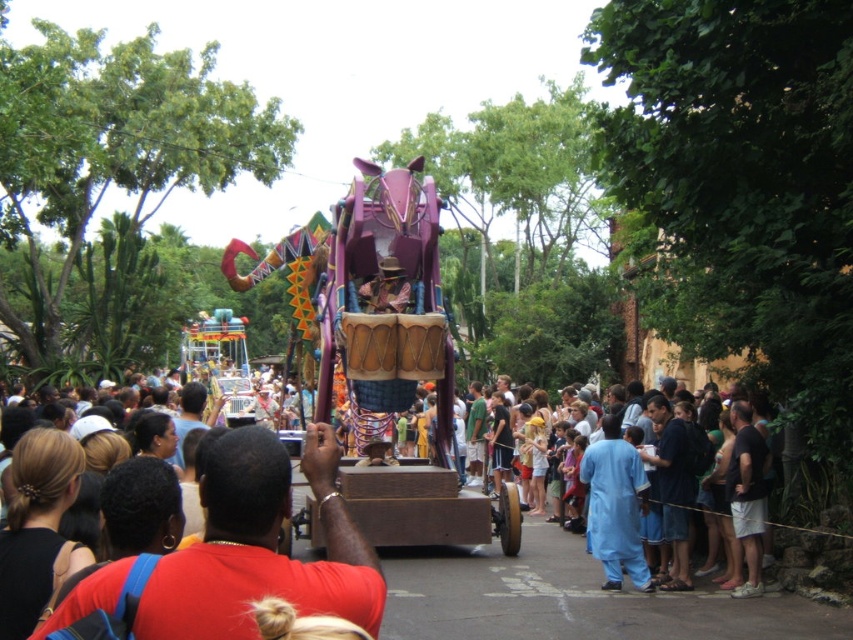
Question: Does red matte shirt at center appear under blue cotton pants at center?

Choices:
 (A) no
 (B) yes

Answer: (A)

Question: Which object is closer to the camera taking this photo?

Choices:
 (A) blue cotton pants at center
 (B) red matte shirt at center

Answer: (B)

Question: Can you confirm if red matte shirt at center is smaller than blue cotton pants at center?

Choices:
 (A) yes
 (B) no

Answer: (B)

Question: Among these points, which one is nearest to the camera?

Choices:
 (A) (608, 524)
 (B) (264, 468)

Answer: (B)

Question: Does red matte shirt at center appear under blue cotton pants at center?

Choices:
 (A) yes
 (B) no

Answer: (B)